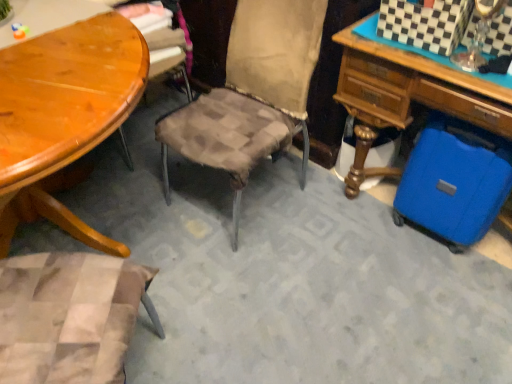
Question: From the image's perspective, is shiny wood table at left located above or below blue hardshell suitcase at lower right?

Choices:
 (A) below
 (B) above

Answer: (A)

Question: Considering the positions of point (17, 114) and point (475, 135), is point (17, 114) closer or farther from the camera than point (475, 135)?

Choices:
 (A) farther
 (B) closer

Answer: (B)

Question: Estimate the real-world distances between objects in this image. Which object is farther from the blue hardshell suitcase at lower right?

Choices:
 (A) shiny wood table at left
 (B) blue hard plastic suitcase at lower right

Answer: (A)

Question: Which object is positioned farthest from the blue hardshell suitcase at lower right?

Choices:
 (A) shiny wood table at left
 (B) blue hard plastic suitcase at lower right

Answer: (A)